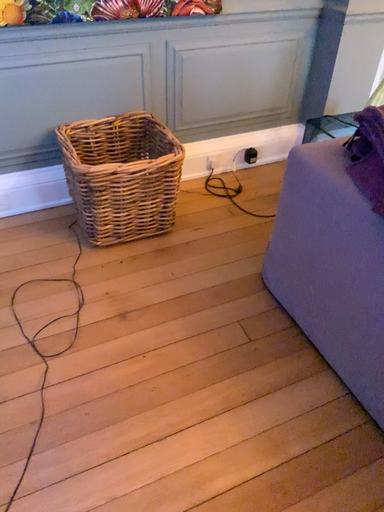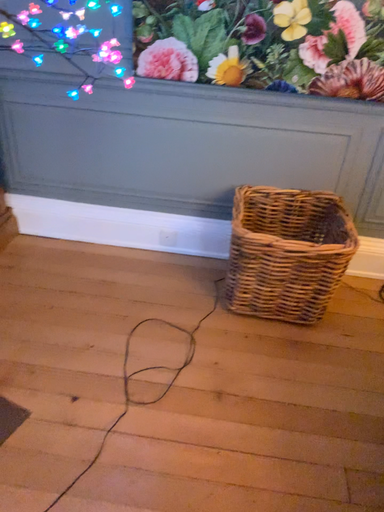
Question: Which way did the camera rotate in the video?

Choices:
 (A) rotated right
 (B) rotated left

Answer: (B)